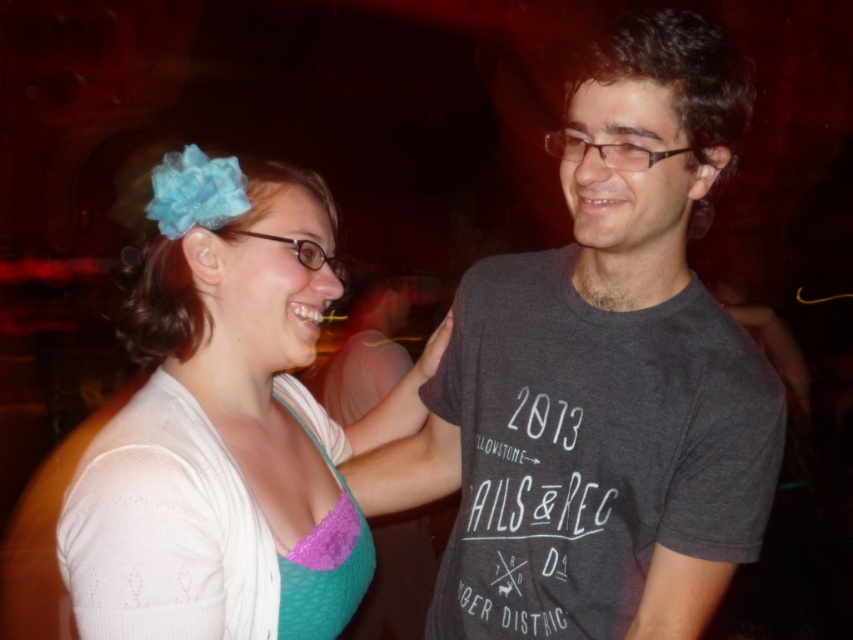
Does gray cotton t-shirt at center come in front of matte blue fabric flower at upper left?

No, gray cotton t-shirt at center is behind matte blue fabric flower at upper left.

Does gray cotton t-shirt at center have a greater width compared to matte blue fabric flower at upper left?

Yes.

At what (x,y) coordinates should I click in order to perform the action: click on gray cotton t-shirt at center. Please return your answer as a coordinate pair (x, y). Looking at the image, I should click on (601, 378).

Between point (183, 362) and point (78, 612), which one is positioned behind?

Positioned behind is point (183, 362).

Is matte blue fabric flower at upper left thinner than purple lace bikini top at left?

Incorrect, matte blue fabric flower at upper left's width is not less than purple lace bikini top at left's.

This screenshot has width=853, height=640. I want to click on matte blue fabric flower at upper left, so click(x=227, y=426).

In order to click on matte blue fabric flower at upper left in this screenshot , I will do pos(227,426).

Can you confirm if gray cotton t-shirt at center is positioned to the left of purple lace bikini top at left?

In fact, gray cotton t-shirt at center is to the right of purple lace bikini top at left.

Based on the photo, is the position of gray cotton t-shirt at center more distant than that of purple lace bikini top at left?

Yes, it is.

In the scene shown: Who is more forward, (x=622, y=566) or (x=170, y=609)?

Point (x=170, y=609)

I want to click on gray cotton t-shirt at center, so click(601, 378).